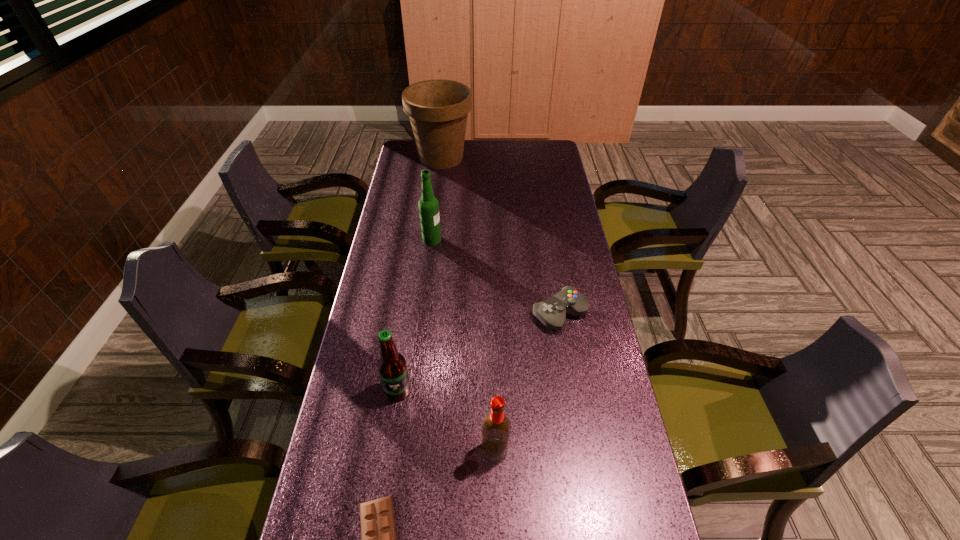
This screenshot has width=960, height=540. Find the location of `the farthest object`. the farthest object is located at coordinates (438, 109).

I want to click on the farthest beer bottle, so click(428, 205).

Locate an element on the screen. Image resolution: width=960 pixels, height=540 pixels. the second farthest object is located at coordinates (428, 205).

Locate an element on the screen. Image resolution: width=960 pixels, height=540 pixels. the fourth farthest object is located at coordinates (392, 368).

Locate an element on the screen. Image resolution: width=960 pixels, height=540 pixels. the rightmost beer bottle is located at coordinates (496, 427).

I want to click on the nearest beer bottle, so click(x=496, y=427).

Image resolution: width=960 pixels, height=540 pixels. I want to click on the fifth tallest object, so click(551, 312).

Image resolution: width=960 pixels, height=540 pixels. In order to click on the third farthest object in this screenshot , I will do `click(551, 312)`.

Find the location of a particular element. The height and width of the screenshot is (540, 960). free space located on the front of the farthest object is located at coordinates (436, 207).

At what (x,y) coordinates should I click in order to perform the action: click on free space located 0.400m on the label of the fifth nearest object. Please return your answer as a coordinate pair (x, y). Looking at the image, I should click on (547, 240).